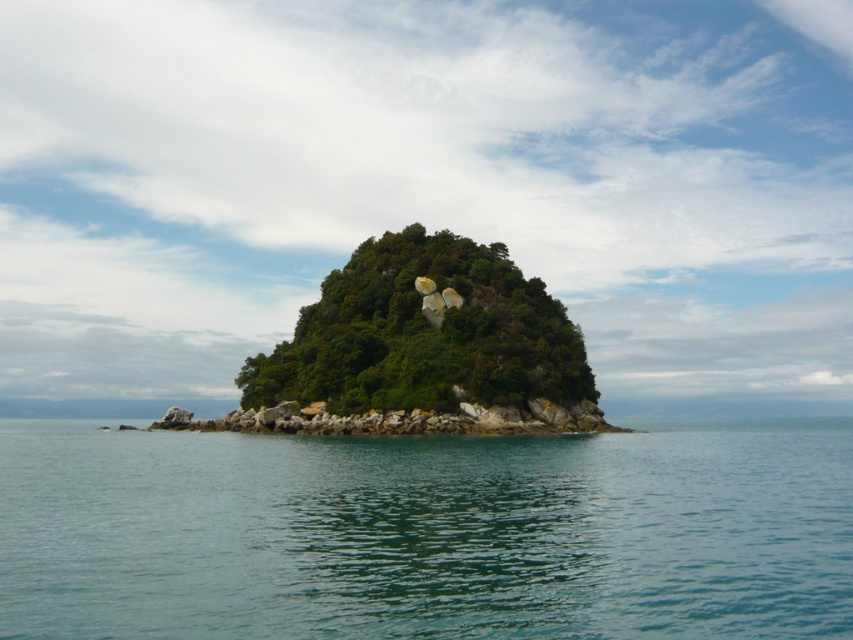
Can you confirm if clear blue water at center is positioned below green leafy island at center?

Yes, clear blue water at center is below green leafy island at center.

Between clear blue water at center and green leafy island at center, which one has less height?

Standing shorter between the two is clear blue water at center.

Identify the location of clear blue water at center. pos(426,532).